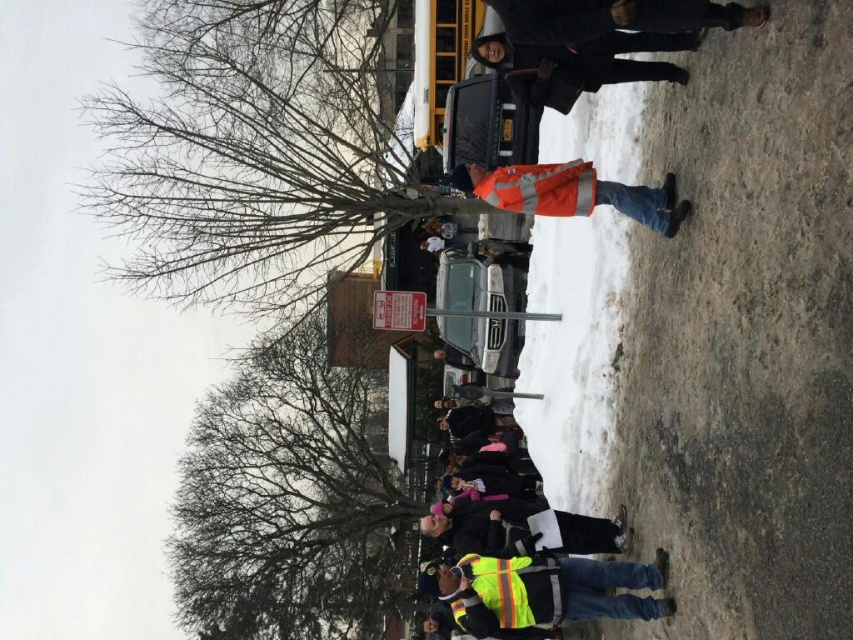
Who is more distant from viewer, (572, 209) or (444, 262)?

Point (444, 262)

Is reflective orange vest at center smaller than metallic silver car at center?

Indeed, reflective orange vest at center has a smaller size compared to metallic silver car at center.

The width and height of the screenshot is (853, 640). Identify the location of reflective orange vest at center. (572, 193).

This screenshot has width=853, height=640. Find the location of `reflective orange vest at center`. reflective orange vest at center is located at coordinates (572, 193).

Which of these two, metallic silver car at center or metallic reflective lift at center, stands shorter?

With less height is metallic reflective lift at center.

The height and width of the screenshot is (640, 853). I want to click on metallic silver car at center, so click(x=476, y=282).

Can you confirm if reflective yellow safety vest at center is thinner than metallic reflective lift at center?

In fact, reflective yellow safety vest at center might be wider than metallic reflective lift at center.

The image size is (853, 640). Identify the location of reflective yellow safety vest at center. 543,589.